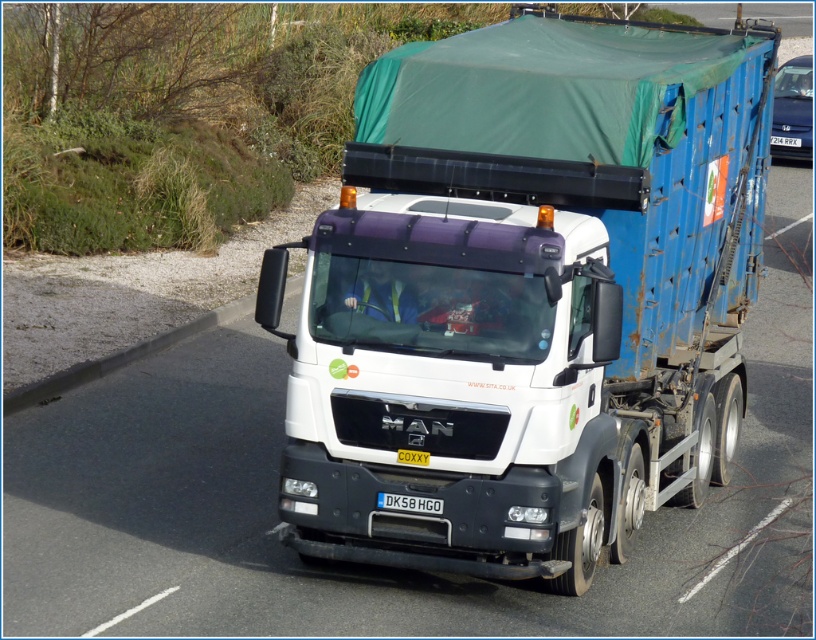
You are a pedestrian standing on the sidewalk next to the road. You see the white matte trailer truck at center and the black plastic license plate at center. Which object is closer to you?

The white matte trailer truck at center is closer to you because it is further to the viewer than the black plastic license plate at center, meaning the license plate is behind the truck and thus farther away.

In the scene shown: You are standing at the position of point (x=411, y=460) and want to move to the position of point (x=779, y=108). Which direction should you move relative to the truck?

You should move behind the truck to reach point (x=779, y=108) since it is located behind point (x=411, y=460).

You are a drone operator trying to track the MAN truck on the road. You have two points marked on your screen at coordinates point (473, 198) and point (382, 508). From the truck driver perspective, which point is closer to the front of the truck?

Point (382, 508) is closer to the front of the truck because it is in front of point (473, 198), which is behind it.